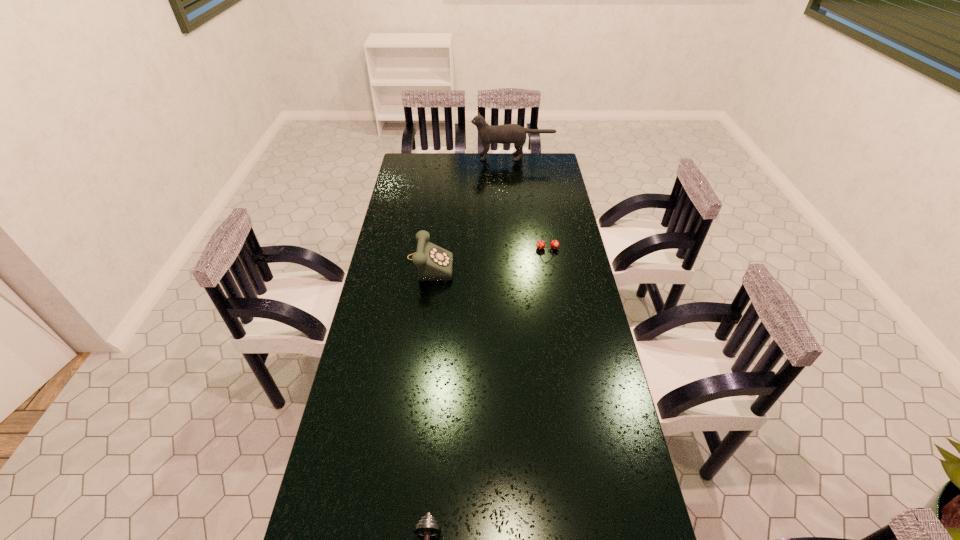
Find the location of `free area in between the cherry and the telephone`. free area in between the cherry and the telephone is located at coordinates (489, 255).

Where is `free space between the cat and the second shortest object`? free space between the cat and the second shortest object is located at coordinates (530, 203).

At what (x,y) coordinates should I click in order to perform the action: click on free space between the tallest object and the cherry. Please return your answer as a coordinate pair (x, y). Image resolution: width=960 pixels, height=540 pixels. Looking at the image, I should click on (530, 203).

I want to click on vacant space that's between the third shortest object and the farthest object, so click(x=471, y=210).

Locate an element on the screen. Image resolution: width=960 pixels, height=540 pixels. free point between the telephone and the cherry is located at coordinates (489, 255).

Identify which object is the third nearest to the dumbbell. Please provide its 2D coordinates. Your answer should be formatted as a tuple, i.e. [(x, y)], where the tuple contains the x and y coordinates of a point satisfying the conditions above.

[(510, 133)]

Identify the location of the second closest object to the telephone. This screenshot has height=540, width=960. (510, 133).

This screenshot has width=960, height=540. What are the coordinates of `vacant space that satisfies the following two spatial constraints: 1. with stems pointing upwards on the second shortest object; 2. on the dial of the third shortest object` in the screenshot? It's located at (550, 262).